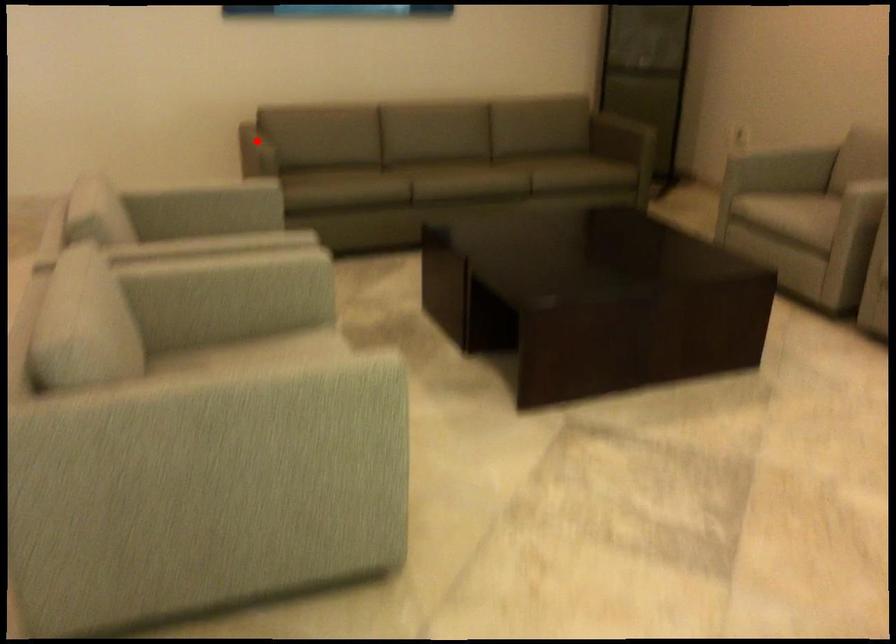
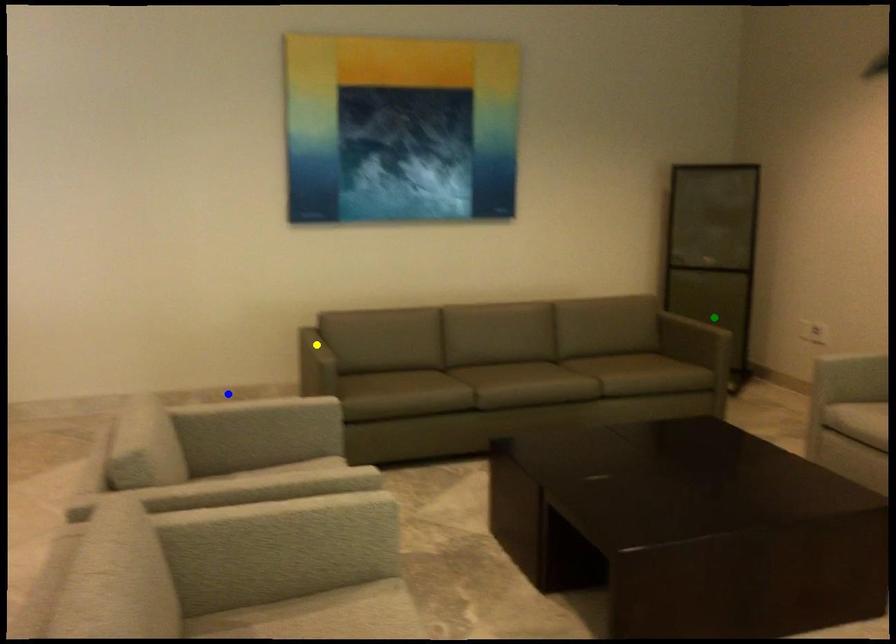
Question: I am providing you with two images of the same scene from different viewpoints. A red point is marked on the first image. You are given multiple points on the second image. Can you choose the point in image 2 that corresponds to the point in image 1?

Choices:
 (A) yellow point
 (B) green point
 (C) blue point

Answer: (A)